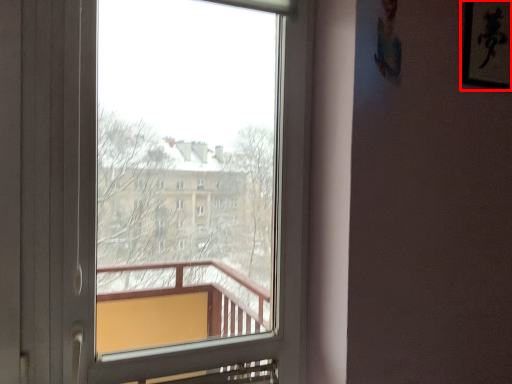
Question: Considering the relative positions of picture frame (annotated by the red box) and window in the image provided, where is picture frame (annotated by the red box) located with respect to the staircase?

Choices:
 (A) left
 (B) right

Answer: (B)